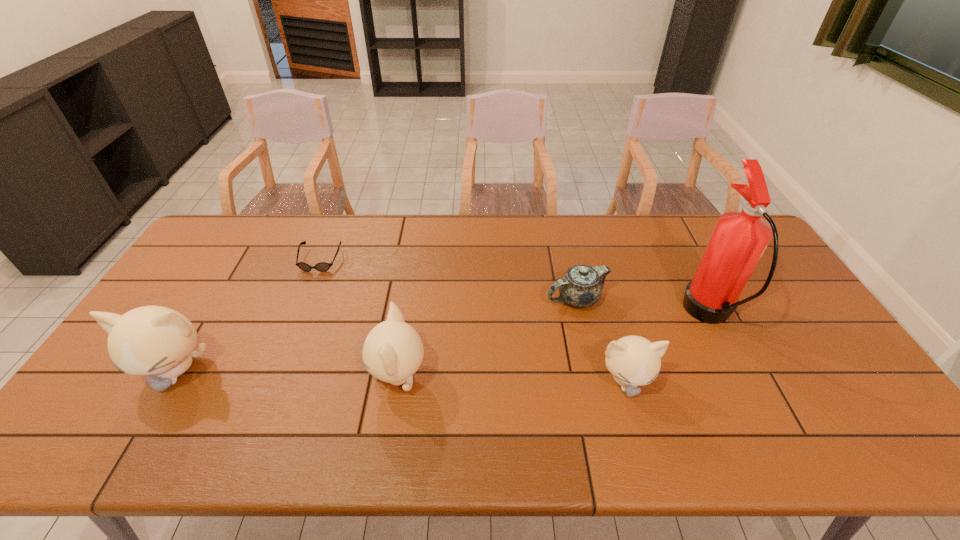
I want to click on the leftmost object, so click(151, 340).

At what (x,y) coordinates should I click in order to perform the action: click on the third tallest object. Please return your answer as a coordinate pair (x, y). This screenshot has width=960, height=540. Looking at the image, I should click on tap(393, 351).

Find the location of a particular element. The image size is (960, 540). the second shortest kitten is located at coordinates (393, 351).

The width and height of the screenshot is (960, 540). I want to click on the rightmost kitten, so click(633, 361).

At what (x,y) coordinates should I click in order to perform the action: click on the third shortest object. Please return your answer as a coordinate pair (x, y). Looking at the image, I should click on (633, 361).

This screenshot has width=960, height=540. Identify the location of the fifth object from right to left. (321, 266).

I want to click on sunglasses, so (321, 266).

Find the location of `the second shortest object`. the second shortest object is located at coordinates (581, 286).

You are a GUI agent. You are given a task and a screenshot of the screen. Output one action in this format:
    pyautogui.click(x=<x>, y=<y>)
    Task: Click on the fire extinguisher
    
    Given the screenshot: What is the action you would take?
    pyautogui.click(x=740, y=238)

At what (x,y) coordinates should I click in order to perform the action: click on the rightmost object. Please return your answer as a coordinate pair (x, y). Looking at the image, I should click on (740, 238).